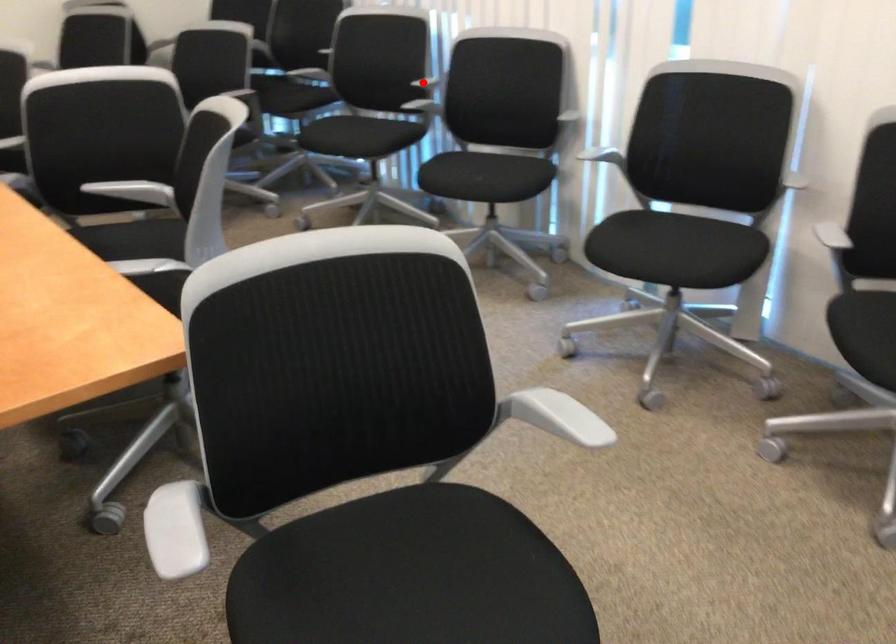
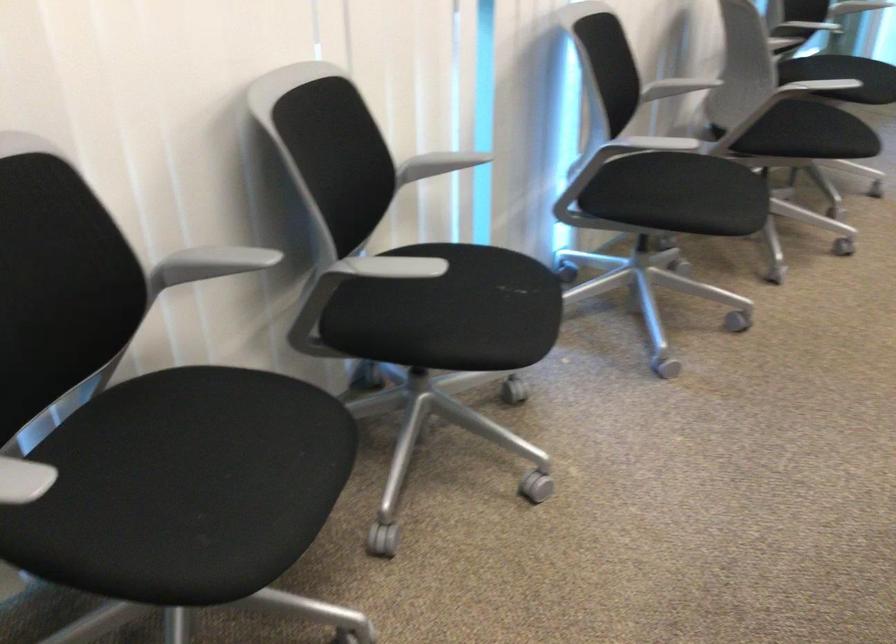
Question: I am providing you with two images of the same scene from different viewpoints. A red point is shown in image1. For the corresponding object point in image2, is it positioned nearer or farther from the camera?

Choices:
 (A) Nearer
 (B) Farther

Answer: (A)